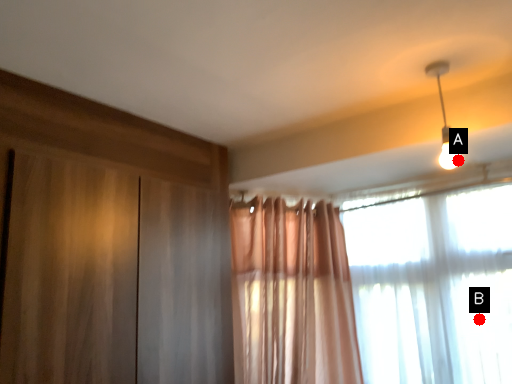
Question: Two points are circled on the image, labeled by A and B beside each circle. Which point appears closest to the camera in this image?

Choices:
 (A) A is closer
 (B) B is closer

Answer: (A)